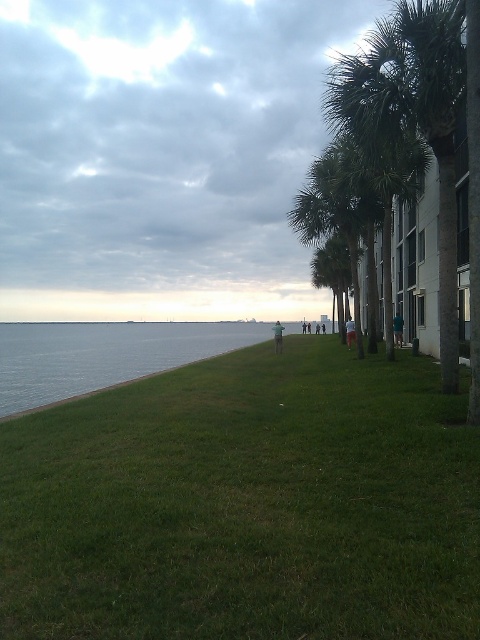
Question: Among these points, which one is farthest from the camera?

Choices:
 (A) (x=283, y=326)
 (B) (x=8, y=353)
 (C) (x=348, y=332)
 (D) (x=166, y=545)

Answer: (B)

Question: Which point appears farthest from the camera in this image?

Choices:
 (A) (396, 342)
 (B) (250, 452)
 (C) (355, 333)
 (D) (264, 326)

Answer: (D)

Question: Does green grassy at lower left have a greater width compared to light brown leather jacket at center?

Choices:
 (A) yes
 (B) no

Answer: (A)

Question: Is green grassy at lower left further to camera compared to blue water at lower left?

Choices:
 (A) no
 (B) yes

Answer: (A)

Question: Does green grassy at lower left have a smaller size compared to blue water at lower left?

Choices:
 (A) no
 (B) yes

Answer: (B)

Question: Which object is positioned farthest from the green grassy at lower left?

Choices:
 (A) green fabric pants at center-right
 (B) blue water at lower left
 (C) light brown leather jacket at center

Answer: (B)